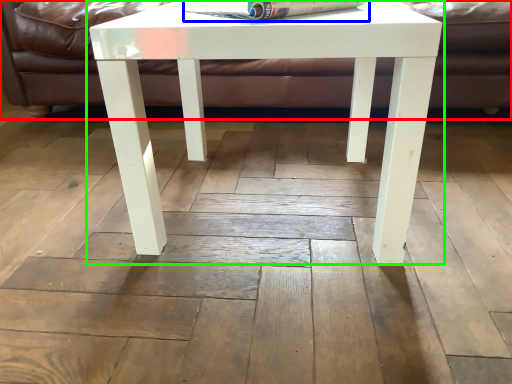
Question: Which object is the closest to the couch (highlighted by a red box)? Choose among these: magazine (highlighted by a blue box) or table (highlighted by a green box).

Choices:
 (A) magazine
 (B) table

Answer: (B)